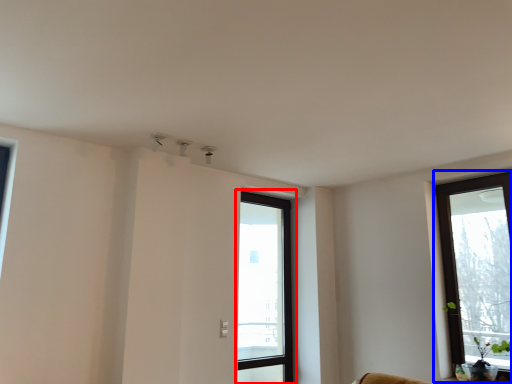
Question: Which of the following is the farthest to the observer, window (highlighted by a red box) or window (highlighted by a blue box)?

Choices:
 (A) window
 (B) window

Answer: (A)